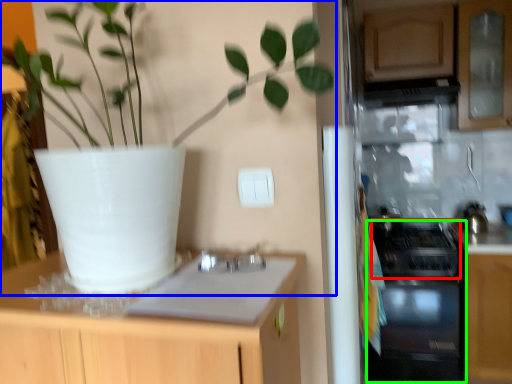
Question: Which is nearer to the gas stove (highlighted by a red box)? houseplant (highlighted by a blue box) or oven (highlighted by a green box).

Choices:
 (A) houseplant
 (B) oven

Answer: (B)